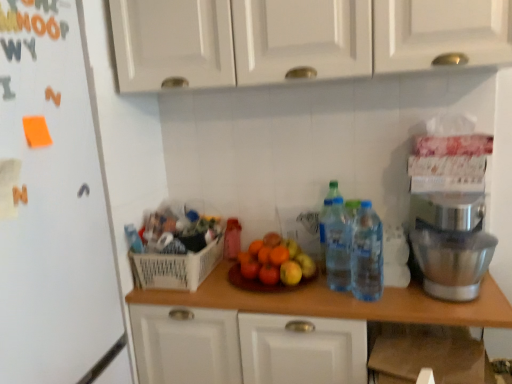
Locate an element on the screen. Image resolution: width=512 pixels, height=384 pixels. vacant area in front of translucent plastic bottle at center, positioned as the 3th bottle in right-to-left order is located at coordinates (222, 273).